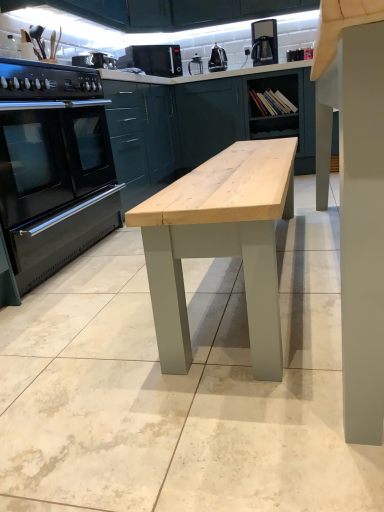
Question: In terms of width, does metallic silver toaster at upper center, the second appliance viewed from the back, look wider or thinner when compared to matte green cabinet at upper center?

Choices:
 (A) thin
 (B) wide

Answer: (A)

Question: Considering their positions, is metallic silver toaster at upper center, the second appliance viewed from the right, located in front of or behind matte green cabinet at upper center?

Choices:
 (A) front
 (B) behind

Answer: (A)

Question: Which object is the closest to the metallic silver kettle at upper center, the first appliance from the back?

Choices:
 (A) metallic silver toaster at upper center, which appears as the second appliance when viewed from the top
 (B) black stainless steel oven at left
 (C) natural wood table at center
 (D) matte green cabinet at upper center
 (E) black matte gas stove at left

Answer: (D)

Question: Considering the real-world distances, which object is closest to the black matte microwave at upper center?

Choices:
 (A) black matte gas stove at left
 (B) matte green cabinet at upper center
 (C) metallic silver kettle at upper center, which appears as the 2th appliance when viewed from the front
 (D) metallic silver toaster at upper center, which appears as the second appliance when viewed from the top
 (E) black plastic coffee machine at upper center

Answer: (B)